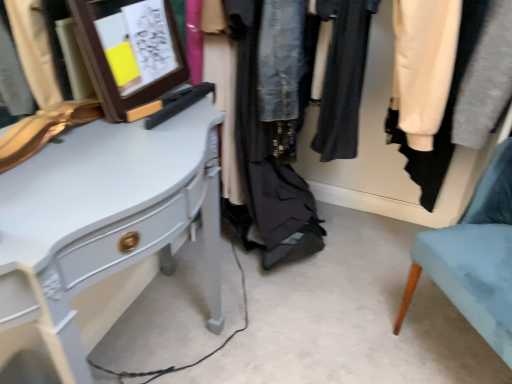
Question: Should I look upward or downward to see light blue fabric chair at lower right?

Choices:
 (A) down
 (B) up

Answer: (A)

Question: Would you say white glossy desk at left is part of wooden frame at upper left's contents?

Choices:
 (A) yes
 (B) no

Answer: (B)

Question: Is wooden frame at upper left looking in the opposite direction of white glossy desk at left?

Choices:
 (A) no
 (B) yes

Answer: (A)

Question: Would you say wooden frame at upper left is a long distance from white glossy desk at left?

Choices:
 (A) no
 (B) yes

Answer: (A)

Question: Can you confirm if wooden frame at upper left is positioned to the left of white glossy desk at left?

Choices:
 (A) yes
 (B) no

Answer: (B)

Question: Does wooden frame at upper left have a lesser width compared to white glossy desk at left?

Choices:
 (A) no
 (B) yes

Answer: (B)

Question: Is wooden frame at upper left located outside white glossy desk at left?

Choices:
 (A) yes
 (B) no

Answer: (A)

Question: Is denim jacket at center completely or partially outside of white glossy desk at left?

Choices:
 (A) no
 (B) yes

Answer: (B)

Question: Is the position of denim jacket at center less distant than that of white glossy desk at left?

Choices:
 (A) no
 (B) yes

Answer: (A)

Question: Does denim jacket at center appear on the right side of white glossy desk at left?

Choices:
 (A) no
 (B) yes

Answer: (B)

Question: From a real-world perspective, does denim jacket at center sit lower than white glossy desk at left?

Choices:
 (A) no
 (B) yes

Answer: (A)

Question: Considering the relative sizes of denim jacket at center and white glossy desk at left in the image provided, is denim jacket at center bigger than white glossy desk at left?

Choices:
 (A) no
 (B) yes

Answer: (B)

Question: Does denim jacket at center have a smaller size compared to white glossy desk at left?

Choices:
 (A) no
 (B) yes

Answer: (A)

Question: Does wooden frame at upper left turn towards light blue fabric chair at lower right?

Choices:
 (A) yes
 (B) no

Answer: (B)